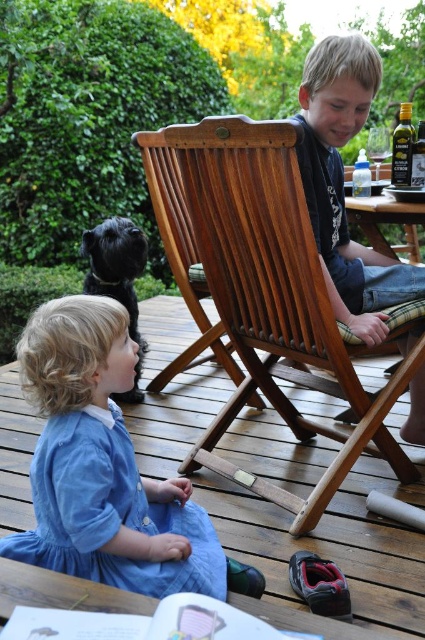
Question: Can you confirm if smooth wooden chair at center is positioned to the right of black shiny dog at left?

Choices:
 (A) no
 (B) yes

Answer: (B)

Question: Which object is the closest to the wooden chair at center?

Choices:
 (A) smooth wooden chair at center
 (B) black shiny dog at left
 (C) blue denim dress at lower left

Answer: (A)

Question: Where is wooden chair at center located in relation to blue denim dress at lower left in the image?

Choices:
 (A) above
 (B) below

Answer: (A)

Question: Among these objects, which one is farthest from the camera?

Choices:
 (A) black shiny dog at left
 (B) wooden picnic table at center

Answer: (A)

Question: Which point is farther to the camera?

Choices:
 (A) (334, 136)
 (B) (340, 353)

Answer: (A)

Question: Does blue denim dress at lower left have a smaller size compared to smooth wooden chair at center?

Choices:
 (A) yes
 (B) no

Answer: (A)